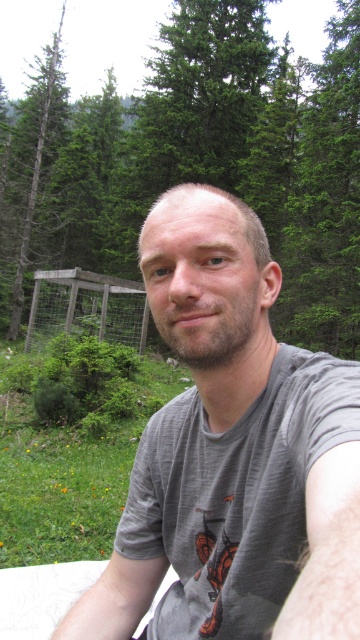
Question: Considering the relative positions of green leafy tree at upper center and gray matte t-shirt at center in the image provided, where is green leafy tree at upper center located with respect to gray matte t-shirt at center?

Choices:
 (A) right
 (B) left

Answer: (B)

Question: Is gray matte t-shirt at center above green leafy tree at left?

Choices:
 (A) yes
 (B) no

Answer: (B)

Question: Which of these objects is positioned closest to the gray matte t-shirt at center?

Choices:
 (A) green leafy tree at upper center
 (B) green leafy tree at left

Answer: (B)

Question: Which object is farther from the camera taking this photo?

Choices:
 (A) green leafy tree at upper center
 (B) gray matte t-shirt at center

Answer: (A)

Question: Observing the image, what is the correct spatial positioning of gray matte t-shirt at center in reference to green leafy tree at left?

Choices:
 (A) left
 (B) right

Answer: (B)

Question: Which of the following is the farthest from the observer?

Choices:
 (A) 19,305
 (B) 154,493
 (C) 59,140

Answer: (C)